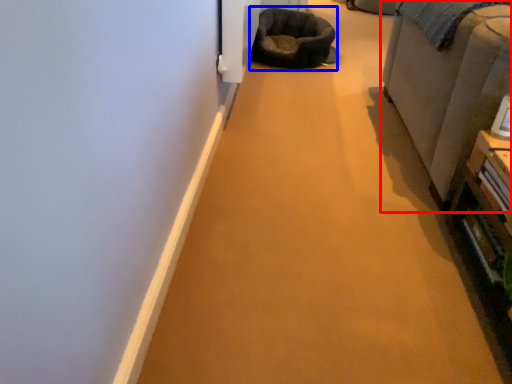
Question: Which point is further to the camera, furniture (highlighted by a red box) or bean bag chair (highlighted by a blue box)?

Choices:
 (A) furniture
 (B) bean bag chair

Answer: (B)